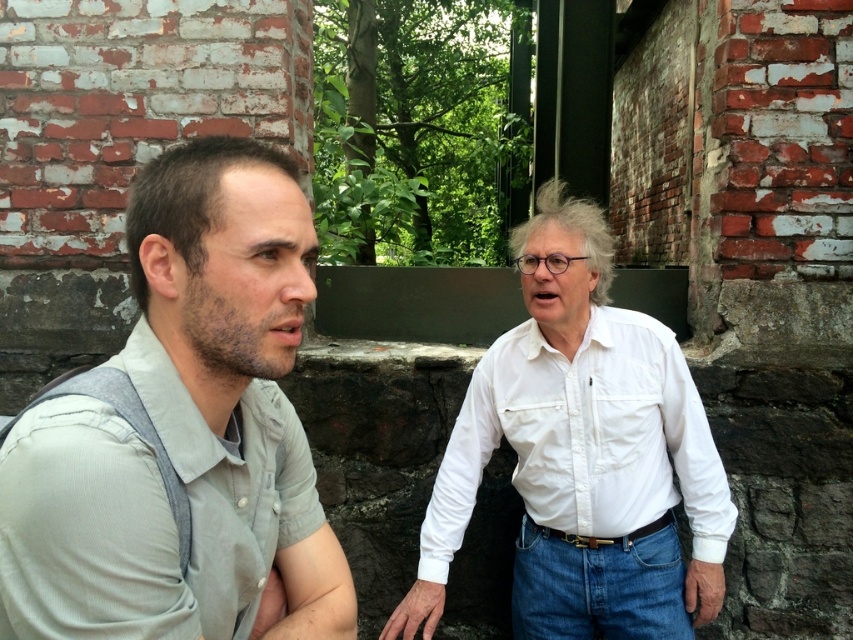
You are standing in front of the brick wall and see the gray cotton shirt at left and the white cotton shirt at center. Which shirt is nearer to you?

The gray cotton shirt at left is closer to the viewer than the white cotton shirt at center, so the gray cotton shirt at left is nearer to you.

You are a photographer trying to capture a candid shot of both the gray cotton shirt at left and the white cotton shirt at center. Since you want to ensure both are visible in the frame, which shirt should you focus on first to avoid missing either in your composition?

The gray cotton shirt at left occupies less space than the white cotton shirt at center, so you should focus on positioning the larger white cotton shirt at center first to ensure it fits within the frame, then adjust to include the smaller gray cotton shirt at left.